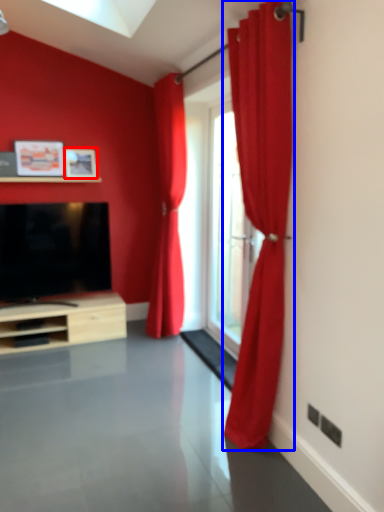
Question: Which point is further to the camera, picture frame (highlighted by a red box) or curtain (highlighted by a blue box)?

Choices:
 (A) picture frame
 (B) curtain

Answer: (A)